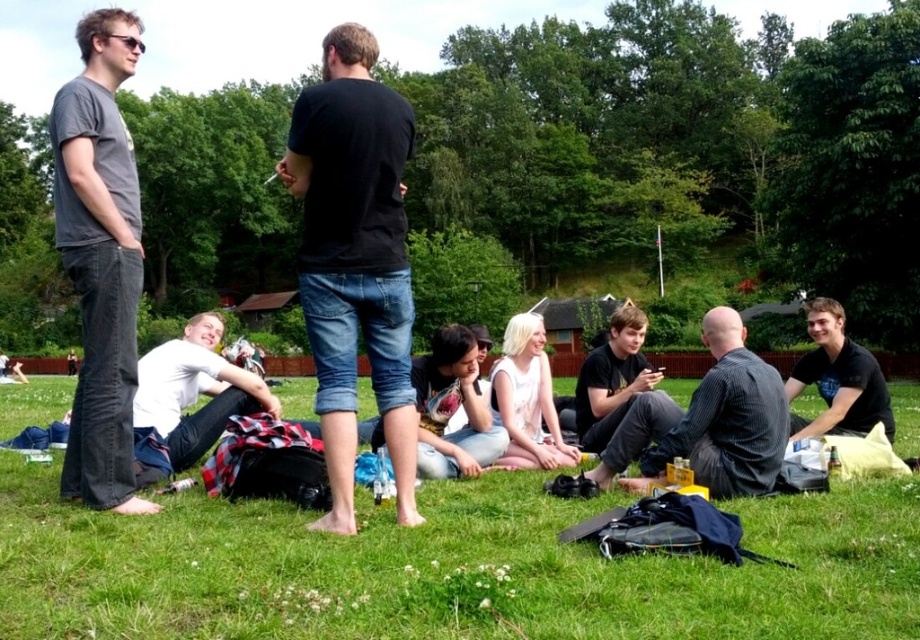
What do you see at coordinates (355, 259) in the screenshot? This screenshot has height=640, width=920. I see `black cotton shirt at center` at bounding box center [355, 259].

Who is positioned more to the right, black cotton shirt at center or denim shorts at center?

From the viewer's perspective, denim shorts at center appears more on the right side.

Is point (300, 108) in front of point (474, 440)?

Yes, point (300, 108) is in front of point (474, 440).

I want to click on black cotton shirt at center, so click(355, 259).

Which is below, dark gray striped shirt at center or black t-shirt at center?

dark gray striped shirt at center

Between point (768, 403) and point (623, 467), which one is positioned in front?

Point (768, 403) is in front.

In order to click on dark gray striped shirt at center in this screenshot , I will do `click(726, 419)`.

Between point (453, 410) and point (853, 384), which one is positioned in front?

Point (453, 410) is more forward.

Does denim shorts at center come behind black cotton shirt at lower right?

Yes, it is.

Describe the element at coordinates (453, 406) in the screenshot. I see `denim shorts at center` at that location.

You are a GUI agent. You are given a task and a screenshot of the screen. Output one action in this format:
    pyautogui.click(x=<x>, y=<y>)
    Task: Click on the denim shorts at center
    The image size is (920, 640).
    Given the screenshot: What is the action you would take?
    pyautogui.click(x=453, y=406)